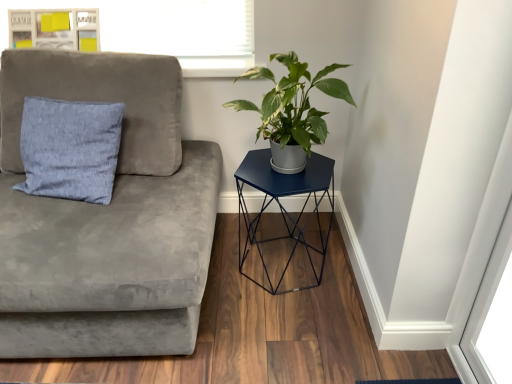
Question: From the image's perspective, is wooden frame at upper left above metallic blue hexagonal table at right?

Choices:
 (A) no
 (B) yes

Answer: (B)

Question: Does wooden frame at upper left have a lesser width compared to metallic blue hexagonal table at right?

Choices:
 (A) yes
 (B) no

Answer: (A)

Question: Can you confirm if wooden frame at upper left is wider than metallic blue hexagonal table at right?

Choices:
 (A) no
 (B) yes

Answer: (A)

Question: Is wooden frame at upper left next to metallic blue hexagonal table at right?

Choices:
 (A) no
 (B) yes

Answer: (A)

Question: Is metallic blue hexagonal table at right surrounded by wooden frame at upper left?

Choices:
 (A) yes
 (B) no

Answer: (B)

Question: Is the position of wooden frame at upper left less distant than that of metallic blue hexagonal table at right?

Choices:
 (A) yes
 (B) no

Answer: (B)

Question: Can you confirm if wooden frame at upper left is thinner than light blue fabric pillow at left?

Choices:
 (A) yes
 (B) no

Answer: (A)

Question: Considering the relative sizes of wooden frame at upper left and light blue fabric pillow at left in the image provided, is wooden frame at upper left bigger than light blue fabric pillow at left?

Choices:
 (A) yes
 (B) no

Answer: (B)

Question: Could light blue fabric pillow at left be considered to be inside wooden frame at upper left?

Choices:
 (A) yes
 (B) no

Answer: (B)

Question: Is wooden frame at upper left closer to camera compared to light blue fabric pillow at left?

Choices:
 (A) no
 (B) yes

Answer: (A)

Question: Considering the relative sizes of wooden frame at upper left and light blue fabric pillow at left in the image provided, is wooden frame at upper left smaller than light blue fabric pillow at left?

Choices:
 (A) yes
 (B) no

Answer: (A)

Question: Does wooden frame at upper left have a lesser height compared to light blue fabric pillow at left?

Choices:
 (A) no
 (B) yes

Answer: (B)

Question: Does suede gray couch at left have a greater height compared to light blue fabric pillow at left?

Choices:
 (A) yes
 (B) no

Answer: (A)